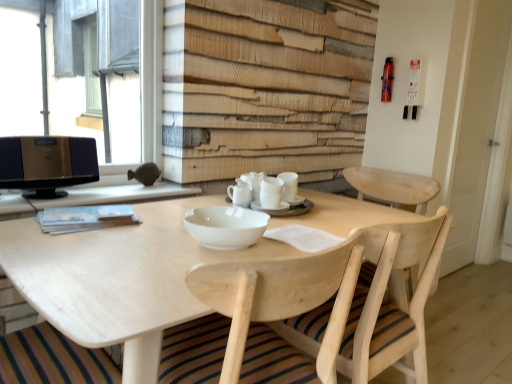
Question: Would you say metallic gray window at upper left contains white ceramic cups at center, which is the 2th tableware in left-to-right order?

Choices:
 (A) yes
 (B) no

Answer: (B)

Question: Is metallic gray window at upper left positioned beyond the bounds of white ceramic cups at center, which is the 2th tableware in left-to-right order?

Choices:
 (A) yes
 (B) no

Answer: (A)

Question: Considering the relative sizes of metallic gray window at upper left and white ceramic cups at center, placed as the 2th tableware when sorted from right to left, in the image provided, is metallic gray window at upper left bigger than white ceramic cups at center, placed as the 2th tableware when sorted from right to left,?

Choices:
 (A) no
 (B) yes

Answer: (B)

Question: From a real-world perspective, is metallic gray window at upper left positioned over white ceramic cups at center, which is the 2th tableware in left-to-right order, based on gravity?

Choices:
 (A) yes
 (B) no

Answer: (A)

Question: Is metallic gray window at upper left in contact with white ceramic cups at center, which is the 2th tableware in left-to-right order?

Choices:
 (A) yes
 (B) no

Answer: (B)

Question: Is metallic gray window at upper left to the left of white ceramic cups at center, which is the 2th tableware in left-to-right order, from the viewer's perspective?

Choices:
 (A) no
 (B) yes

Answer: (B)

Question: Is white ceramic cups at center, placed as the 2th tableware when sorted from right to left, to the left of white wooden door at right from the viewer's perspective?

Choices:
 (A) no
 (B) yes

Answer: (B)

Question: From a real-world perspective, is white ceramic cups at center, which is the 2th tableware in left-to-right order, beneath white wooden door at right?

Choices:
 (A) yes
 (B) no

Answer: (A)

Question: Does white ceramic cups at center, placed as the 2th tableware when sorted from right to left, have a greater height compared to white wooden door at right?

Choices:
 (A) no
 (B) yes

Answer: (A)

Question: Is white ceramic cups at center, which is the 2th tableware in left-to-right order, shorter than white wooden door at right?

Choices:
 (A) no
 (B) yes

Answer: (B)

Question: Does white ceramic cups at center, which is the 2th tableware in left-to-right order, touch white wooden door at right?

Choices:
 (A) no
 (B) yes

Answer: (A)

Question: Is white ceramic cups at center, which is the 2th tableware in left-to-right order, facing away from white wooden door at right?

Choices:
 (A) yes
 (B) no

Answer: (B)

Question: From the image's perspective, would you say natural wood table at center is shown under white ceramic cups at center, placed as the 2th tableware when sorted from right to left?

Choices:
 (A) yes
 (B) no

Answer: (A)